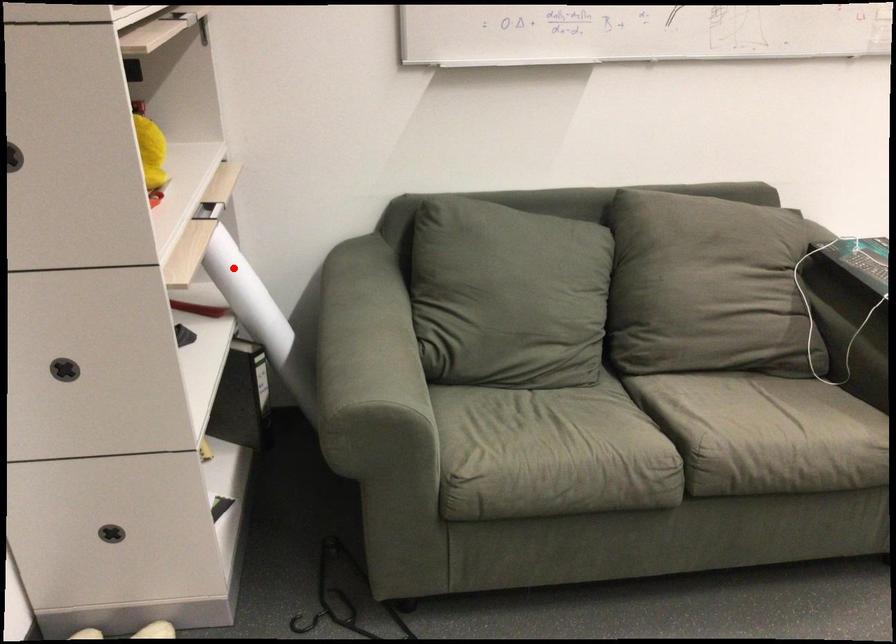
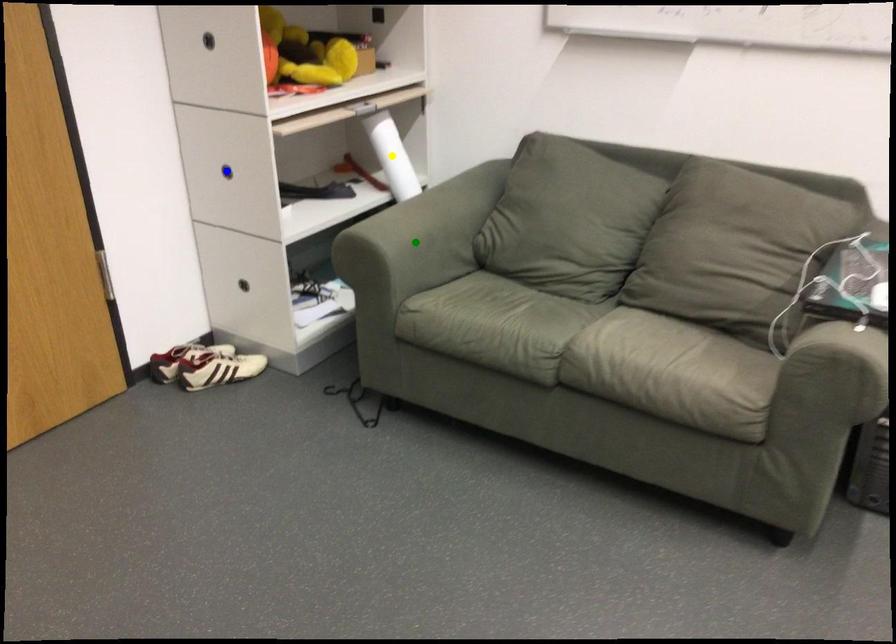
Question: I am providing you with two images of the same scene from different viewpoints. A red point is marked on the first image. You are given multiple points on the second image. Which spot in image 2 lines up with the point in image 1?

Choices:
 (A) blue point
 (B) yellow point
 (C) green point

Answer: (B)